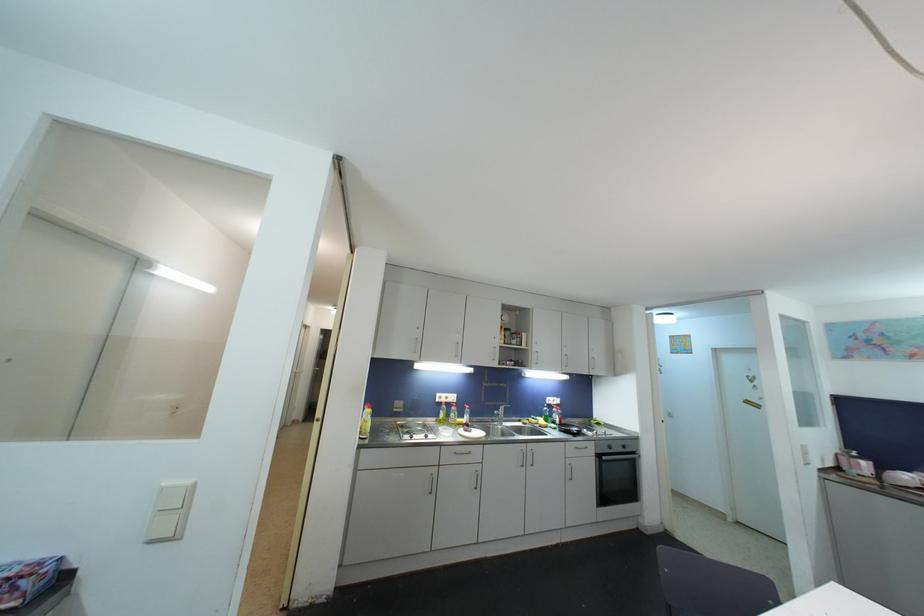
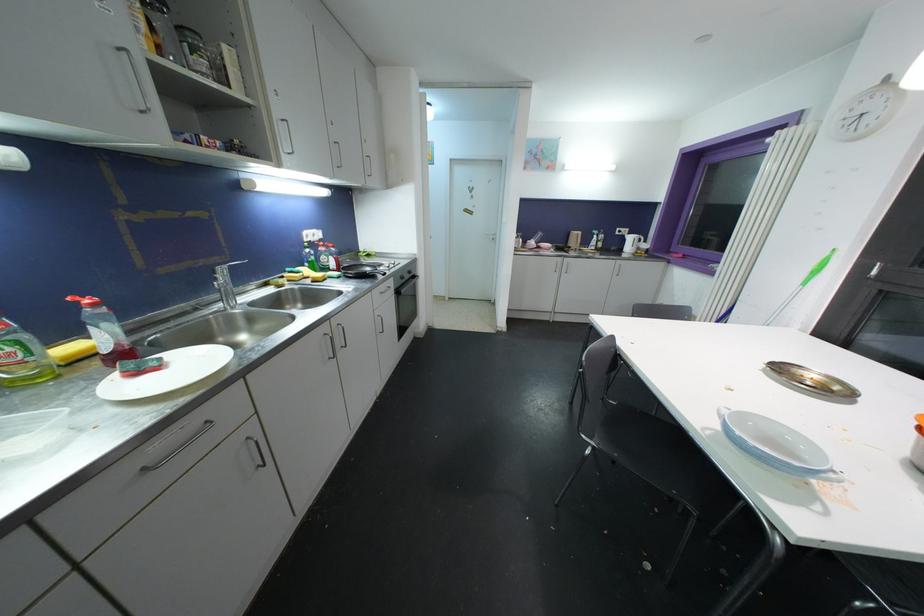
Locate, in the second image, the point that corresponds to pixel 602 459 in the first image.

(400, 294)